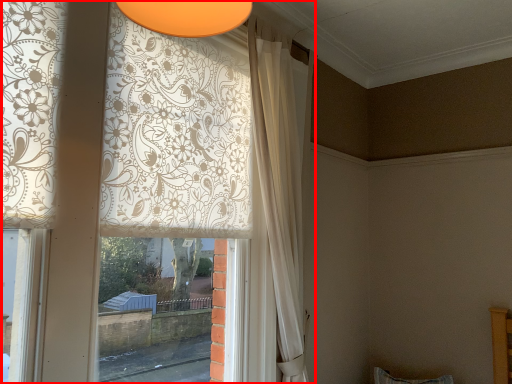
Question: From the image's perspective, considering the relative positions of curtain (annotated by the red box) and curtain in the image provided, where is curtain (annotated by the red box) located with respect to the staircase?

Choices:
 (A) above
 (B) below

Answer: (A)